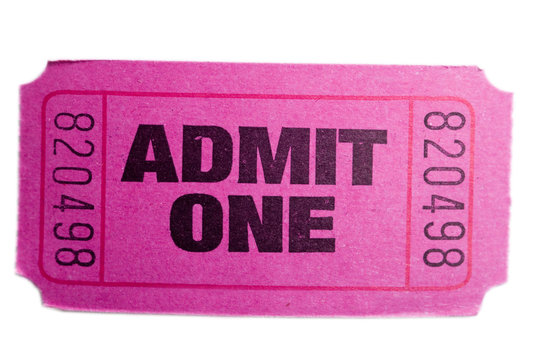
I want to click on entry, so click(272, 268).